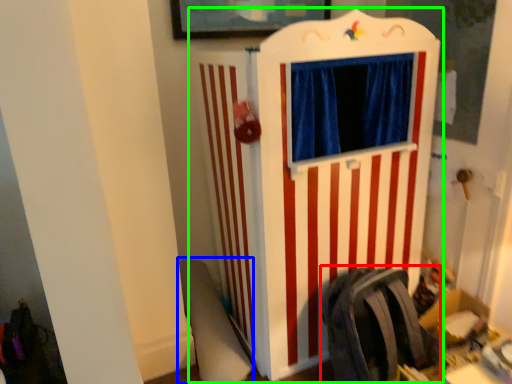
Question: Estimate the real-world distances between objects in this image. Which object is closer to folding chair (highlighted by a red box), swivel chair (highlighted by a blue box) or furniture (highlighted by a green box)?

Choices:
 (A) swivel chair
 (B) furniture

Answer: (B)